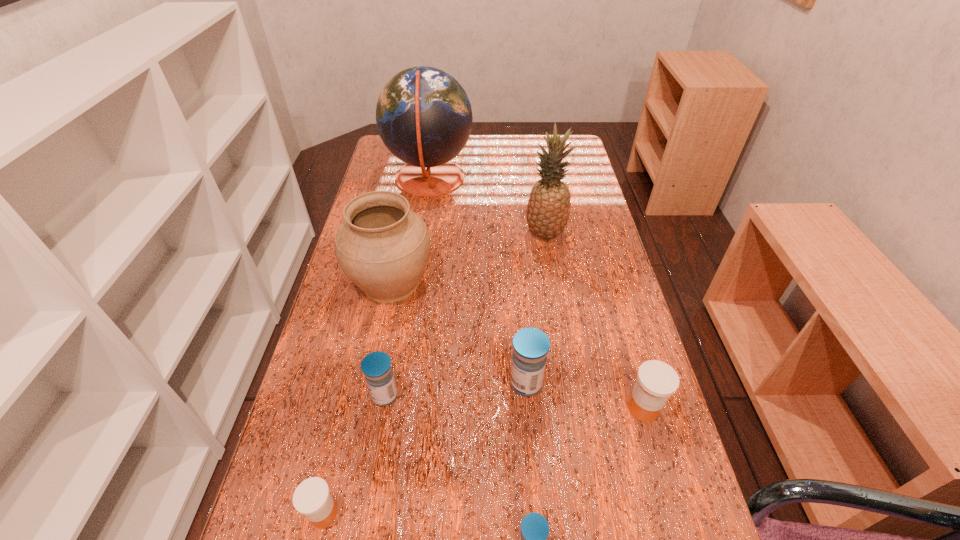
At what (x,y) coordinates should I click in order to perform the action: click on the smaller orange medicine. Please return your answer as a coordinate pair (x, y). The image size is (960, 540). Looking at the image, I should click on (312, 498).

You are a GUI agent. You are given a task and a screenshot of the screen. Output one action in this format:
    pyautogui.click(x=<x>, y=<y>)
    Task: Click on the nearer orange medicine
    The image size is (960, 540).
    Given the screenshot: What is the action you would take?
    point(312,498)

Locate an element on the screen. free spot located with the Americas facing the viewer on the globe is located at coordinates (550, 179).

Where is `free space located on the back of the pineapple`? This screenshot has height=540, width=960. free space located on the back of the pineapple is located at coordinates (537, 185).

The height and width of the screenshot is (540, 960). Find the location of `free region located on the back of the urn`. free region located on the back of the urn is located at coordinates (401, 231).

The height and width of the screenshot is (540, 960). I want to click on free space located on the left of the biggest blue medicine, so click(359, 383).

The image size is (960, 540). Identify the location of free space located on the left of the second biggest blue medicine. (301, 395).

Identify the location of vacant space located 0.140m on the label of the rightmost object. The height and width of the screenshot is (540, 960). (668, 498).

You are a GUI agent. You are given a task and a screenshot of the screen. Output one action in this format:
    pyautogui.click(x=<x>, y=<y>)
    Task: Click on the object located in the far edge section of the desktop
    The width and height of the screenshot is (960, 540).
    Given the screenshot: What is the action you would take?
    pyautogui.click(x=424, y=117)

I want to click on globe located at the left edge, so tap(424, 117).